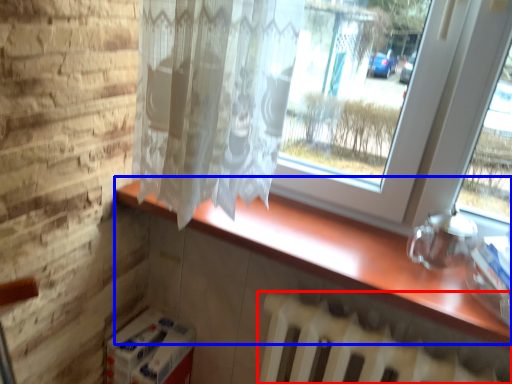
Question: Which object appears closest to the camera in this image, radiator (highlighted by a red box) or counter top (highlighted by a blue box)?

Choices:
 (A) radiator
 (B) counter top

Answer: (A)